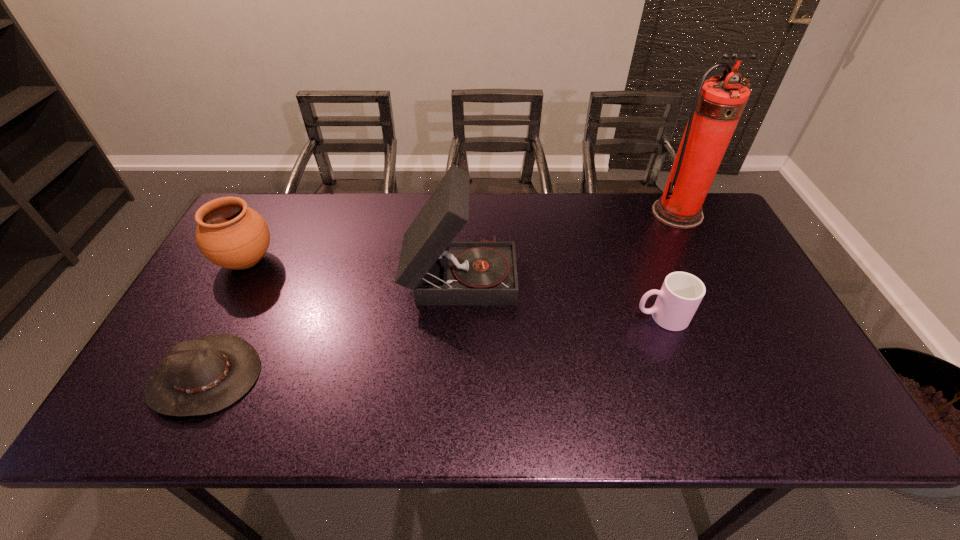
Locate an element on the screen. free space located on the front-facing side of the phonograph_record is located at coordinates (571, 274).

Identify the location of vacant space located 0.140m on the right of the third shortest object. The image size is (960, 540). (325, 261).

The height and width of the screenshot is (540, 960). What are the coordinates of `free point located with the handle on the side of the cup` in the screenshot? It's located at (507, 318).

Identify the location of free space located with the handle on the side of the cup. (550, 318).

Locate an element on the screen. free space located 0.080m with the handle on the side of the cup is located at coordinates (604, 318).

Where is `object that is positioned at the far edge`? The width and height of the screenshot is (960, 540). object that is positioned at the far edge is located at coordinates coord(719,102).

The width and height of the screenshot is (960, 540). I want to click on object that is at the near edge, so click(203, 376).

At what (x,y) coordinates should I click in order to perform the action: click on pottery positioned at the left edge. Please return your answer as a coordinate pair (x, y). The height and width of the screenshot is (540, 960). Looking at the image, I should click on (229, 234).

Where is `hat that is at the left edge`? hat that is at the left edge is located at coordinates coord(203,376).

Where is `object that is at the right edge`? This screenshot has width=960, height=540. object that is at the right edge is located at coordinates (719, 102).